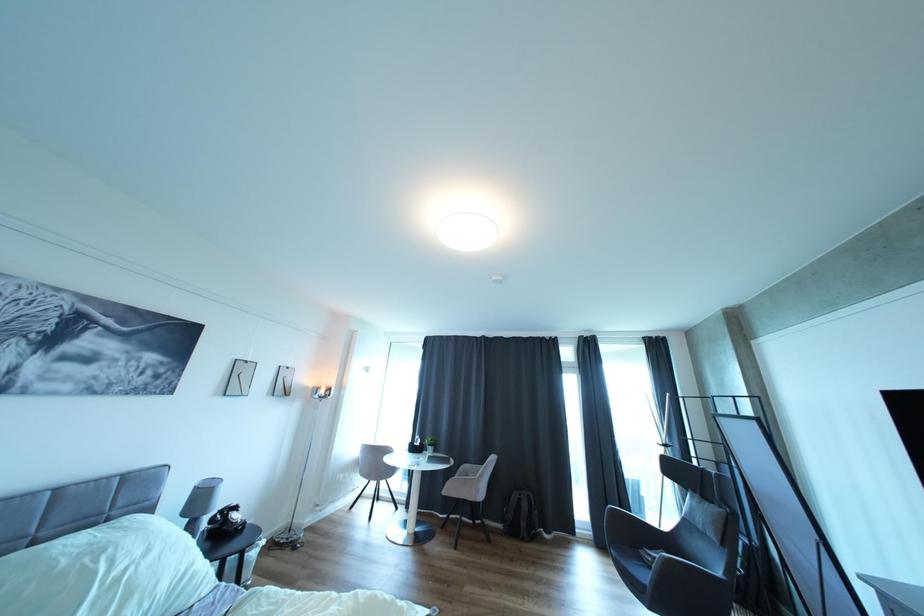
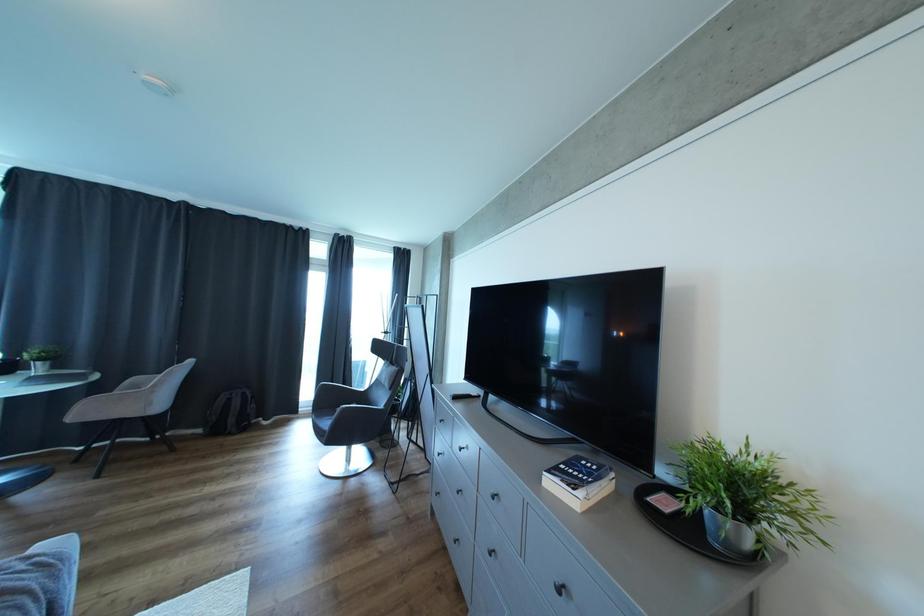
Question: The camera is either moving clockwise (left) or counter-clockwise (right) around the object. The first image is from the beginning of the video and the second image is from the end. Is the camera moving left or right when shooting the video?

Choices:
 (A) Left
 (B) Right

Answer: (A)